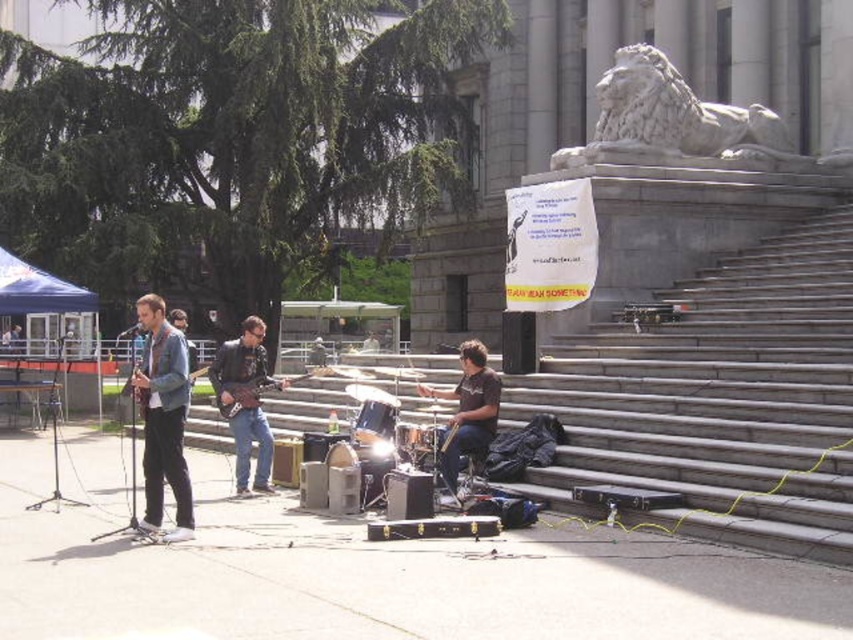
Is point (223, 369) less distant than point (219, 388)?

That is False.

Which is behind, point (219, 355) or point (241, 388)?

Positioned behind is point (219, 355).

Identify the location of wooden guitar at center. This screenshot has width=853, height=640. (245, 401).

Which is in front, point (175, 400) or point (258, 387)?

Point (175, 400)

Based on the photo, who is lower down, denim jacket at left or wooden electric guitar at center?

Positioned lower is wooden electric guitar at center.

Identify the location of denim jacket at left. (163, 417).

At what (x,y) coordinates should I click in order to perform the action: click on denim jacket at left. Please return your answer as a coordinate pair (x, y). The image size is (853, 640). Looking at the image, I should click on (163, 417).

Is denim jacket at left closer to camera compared to dark brown leather drum set at center?

Yes, denim jacket at left is in front of dark brown leather drum set at center.

Who is taller, denim jacket at left or dark brown leather drum set at center?

denim jacket at left is taller.

Image resolution: width=853 pixels, height=640 pixels. What do you see at coordinates (163, 417) in the screenshot?
I see `denim jacket at left` at bounding box center [163, 417].

The image size is (853, 640). In order to click on denim jacket at left in this screenshot , I will do `click(163, 417)`.